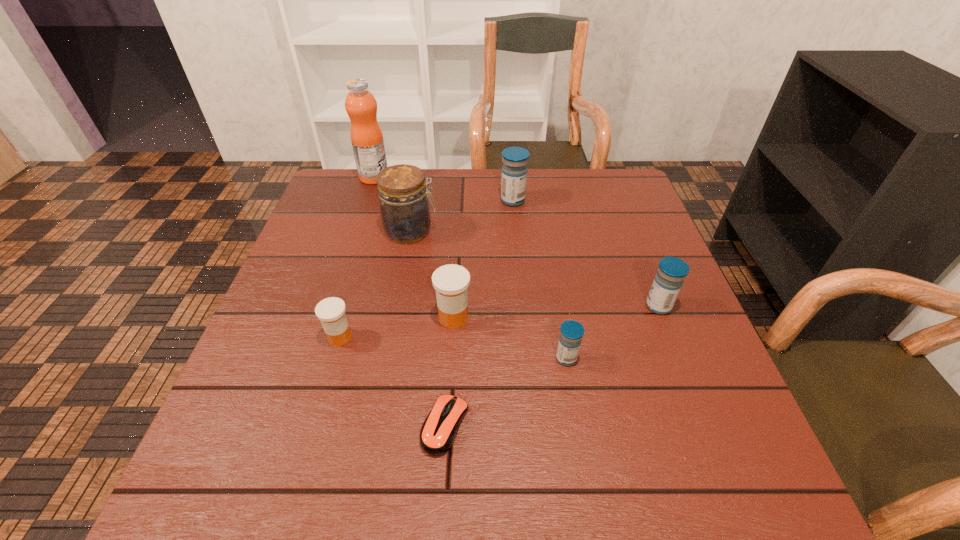
Select which blue medicine appears as the closest to the seventh farthest object. Please provide its 2D coordinates. Your answer should be formatted as a tuple, i.e. [(x, y)], where the tuple contains the x and y coordinates of a point satisfying the conditions above.

[(668, 281)]

Choose which blue medicine is the third nearest neighbor to the sixth object from right to left. Please provide its 2D coordinates. Your answer should be formatted as a tuple, i.e. [(x, y)], where the tuple contains the x and y coordinates of a point satisfying the conditions above.

[(668, 281)]

Find the location of a particular element. This screenshot has height=540, width=960. blank area in the image that satisfies the following two spatial constraints: 1. on the label of the seventh object from left to right; 2. on the left side of the left orange medicine is located at coordinates (334, 359).

The image size is (960, 540). In order to click on vacant space that satisfies the following two spatial constraints: 1. on the lid of the rightmost object; 2. on the left side of the third object from left to right in this screenshot , I will do `click(396, 306)`.

Image resolution: width=960 pixels, height=540 pixels. What are the coordinates of `vacant space that satisfies the following two spatial constraints: 1. on the front side of the second medicine from right to left; 2. on the right side of the farthest object` in the screenshot? It's located at (316, 359).

Identify the location of vacant space that satisfies the following two spatial constraints: 1. on the label of the right orange medicine; 2. on the label of the smaller orange medicine. The width and height of the screenshot is (960, 540). (452, 337).

Where is `free point that satisfies the following two spatial constraints: 1. on the back side of the biggest blue medicine; 2. on the left side of the shortest object`? The image size is (960, 540). free point that satisfies the following two spatial constraints: 1. on the back side of the biggest blue medicine; 2. on the left side of the shortest object is located at coordinates (459, 200).